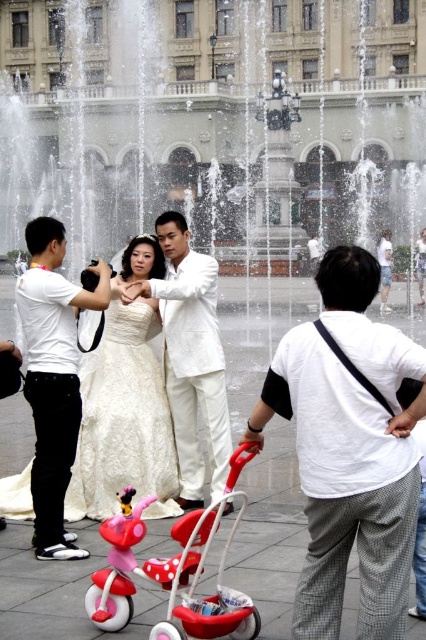
Question: Which is nearer to the white matte suit at center?

Choices:
 (A) white satin dress at center
 (B) matte pink plastic baby carriage at center
 (C) white matte shirt at left

Answer: (A)

Question: Which point is closer to the camera?

Choices:
 (A) (37, 486)
 (B) (325, 381)
 (C) (207, 387)

Answer: (B)

Question: Can you confirm if white cotton shirt at center is bigger than white matte suit at center?

Choices:
 (A) yes
 (B) no

Answer: (B)

Question: Considering the relative positions of white satin dress at center and white matte suit at center in the image provided, where is white satin dress at center located with respect to white matte suit at center?

Choices:
 (A) left
 (B) right

Answer: (A)

Question: Among these objects, which one is farthest from the camera?

Choices:
 (A) white satin dress at center
 (B) white matte shirt at left
 (C) white matte suit at center

Answer: (A)

Question: Is white cotton shirt at center below white matte suit at center?

Choices:
 (A) yes
 (B) no

Answer: (A)